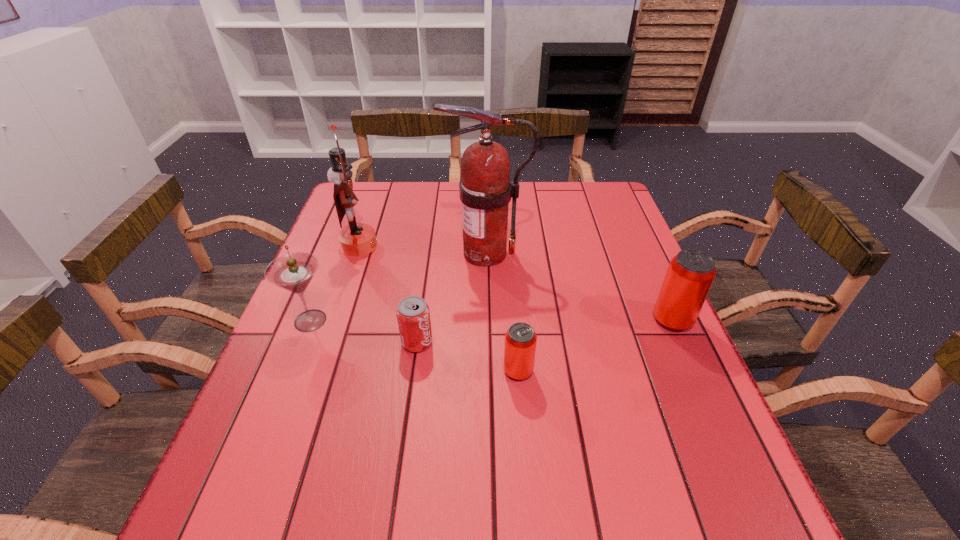
The image size is (960, 540). Identify the location of free space that satisfies the following two spatial constraints: 1. on the front-facing side of the nutcracker; 2. on the left side of the nearer can. pyautogui.click(x=317, y=370).

Image resolution: width=960 pixels, height=540 pixels. Identify the location of vacant point that satisfies the following two spatial constraints: 1. on the front-facing side of the nutcracker; 2. on the right side of the farther can. (334, 320).

Where is `free point that satisfies the following two spatial constraints: 1. on the back side of the soda can; 2. on the front-facing side of the nutcracker`? free point that satisfies the following two spatial constraints: 1. on the back side of the soda can; 2. on the front-facing side of the nutcracker is located at coordinates (430, 246).

Find the location of a particular element. vacant space that satisfies the following two spatial constraints: 1. at the nozzle of the shorter can; 2. on the left side of the fire extinguisher is located at coordinates (488, 370).

The width and height of the screenshot is (960, 540). Identify the location of vacant area that satisfies the following two spatial constraints: 1. on the back side of the right can; 2. on the right side of the martini. (311, 320).